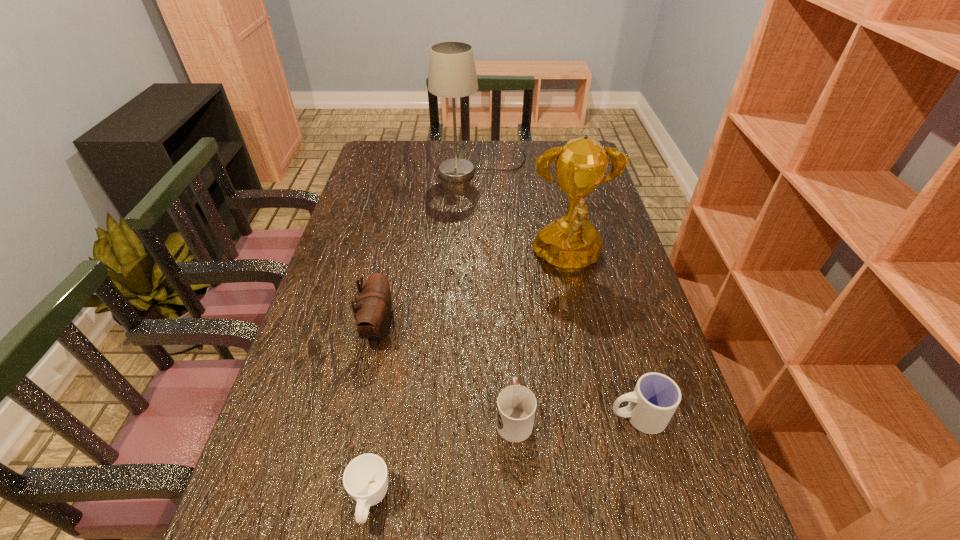
At what (x,y) coordinates should I click in order to perform the action: click on blank space located 0.120m on the right of the table lamp. Please return your answer as a coordinate pair (x, y). The width and height of the screenshot is (960, 540). Looking at the image, I should click on tap(560, 168).

Locate an element on the screen. vacant point located 0.350m on the front side of the award is located at coordinates (599, 411).

Image resolution: width=960 pixels, height=540 pixels. Find the location of `vacant area located with the flap open on the third tallest object`. vacant area located with the flap open on the third tallest object is located at coordinates (462, 328).

This screenshot has height=540, width=960. In order to click on free location located 0.320m with the handle on the side of the rightmost cup in this screenshot , I will do `click(453, 416)`.

Where is `free location located 0.400m with the handle on the side of the rightmost cup`? The width and height of the screenshot is (960, 540). free location located 0.400m with the handle on the side of the rightmost cup is located at coordinates (414, 416).

This screenshot has height=540, width=960. Identify the location of vacant point located 0.210m with the handle on the side of the rightmost cup. (507, 416).

The height and width of the screenshot is (540, 960). I want to click on vacant point located 0.320m on the handle side of the second cup from right to left, so click(x=506, y=288).

Where is `blank area located 0.220m on the handle side of the second cup from right to left`? blank area located 0.220m on the handle side of the second cup from right to left is located at coordinates (508, 316).

Find the location of a particular element. vacant space located 0.060m on the handle side of the second cup from right to left is located at coordinates (512, 370).

Locate an element on the screen. object at the far edge is located at coordinates (452, 73).